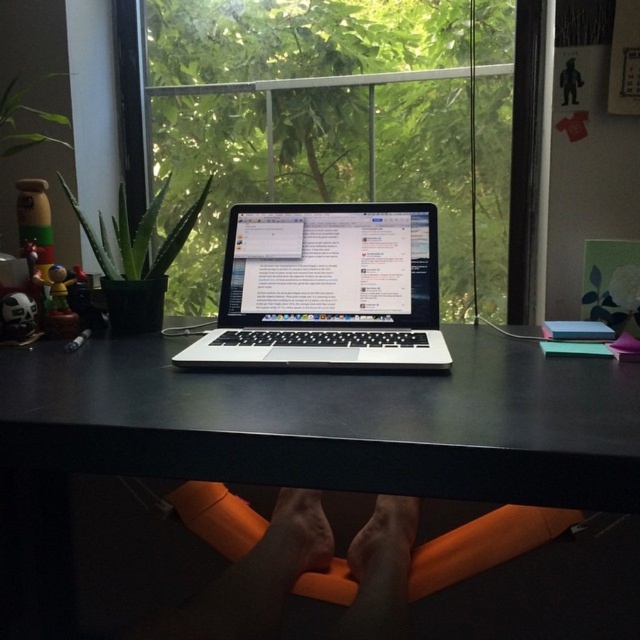
Question: Can you confirm if transparent glass window at center is positioned below black matte computer desk at center?

Choices:
 (A) no
 (B) yes

Answer: (A)

Question: Can you confirm if black matte computer desk at center is bigger than silver/black laptop at center?

Choices:
 (A) no
 (B) yes

Answer: (B)

Question: Which of the following is the closest to the observer?

Choices:
 (A) (260, 205)
 (B) (524, 362)
 (C) (305, 83)

Answer: (B)

Question: Is black matte computer desk at center below silver/black laptop at center?

Choices:
 (A) yes
 (B) no

Answer: (A)

Question: Which object is farther from the camera taking this photo?

Choices:
 (A) silver/black laptop at center
 (B) transparent glass window at center
 (C) black matte computer desk at center

Answer: (B)

Question: Which object is closer to the camera taking this photo?

Choices:
 (A) black matte computer desk at center
 (B) silver/black laptop at center
 (C) transparent glass window at center

Answer: (A)